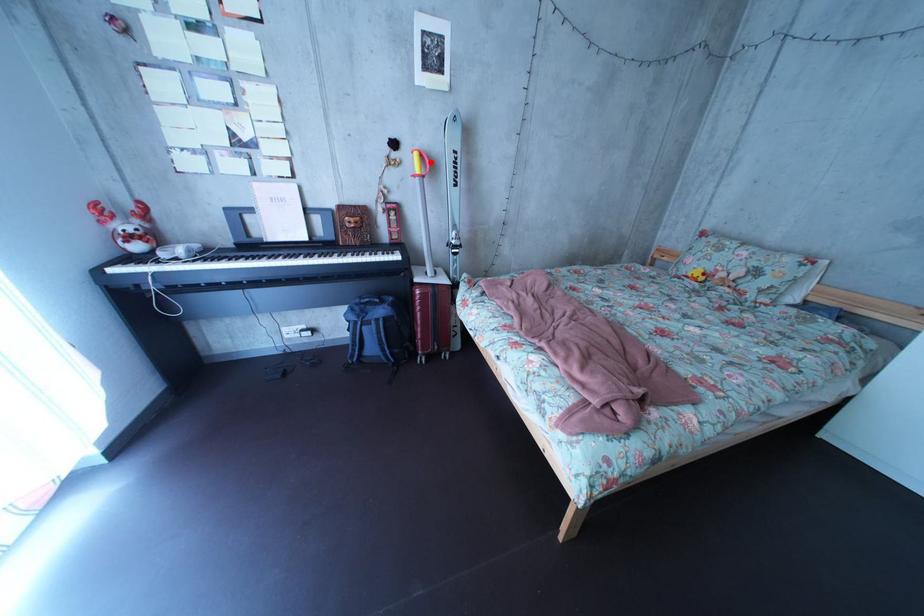
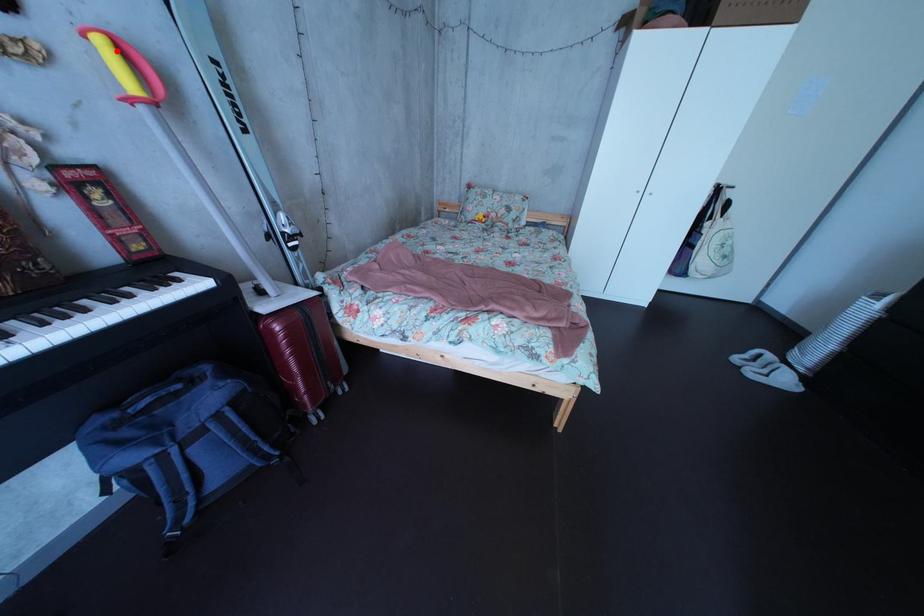
I am providing you with two images of the same scene from different viewpoints. A red point is marked on the first image and another point is marked on the second image. Are the points marked in image1 and image2 representing the same 3D position?

Yes